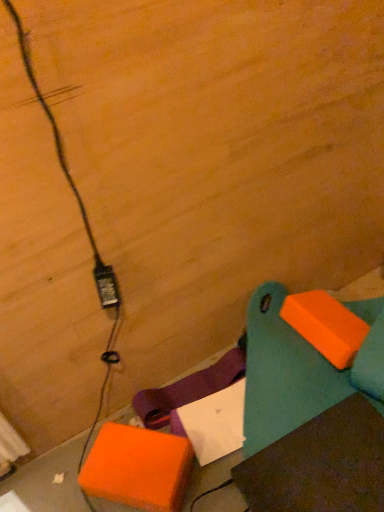
What do you see at coordinates (311, 416) in the screenshot? I see `teal plastic bench at lower right` at bounding box center [311, 416].

Where is `orange matte cardboard box at lower left`? orange matte cardboard box at lower left is located at coordinates (138, 468).

What's the angular difference between teal plastic bench at lower right and black plastic power plug at lower left's facing directions?

teal plastic bench at lower right and black plastic power plug at lower left are facing 73.4 degrees away from each other.

From a real-world perspective, is teal plastic bench at lower right physically above black plastic power plug at lower left?

No, from a real-world perspective, teal plastic bench at lower right is not above black plastic power plug at lower left.

Based on the photo, which of these two, teal plastic bench at lower right or black plastic power plug at lower left, stands shorter?

With less height is black plastic power plug at lower left.

Is teal plastic bench at lower right looking in the opposite direction of black plastic power plug at lower left?

No, black plastic power plug at lower left is not at the back of teal plastic bench at lower right.

Considering the positions of objects orange matte cardboard box at lower left and teal plastic bench at lower right in the image provided, who is behind, orange matte cardboard box at lower left or teal plastic bench at lower right?

orange matte cardboard box at lower left is behind.

Between orange matte cardboard box at lower left and teal plastic bench at lower right, which one has less height?

Standing shorter between the two is orange matte cardboard box at lower left.

Does orange matte cardboard box at lower left have a greater width compared to teal plastic bench at lower right?

No.

Is orange matte cardboard box at lower left facing towards teal plastic bench at lower right?

No, orange matte cardboard box at lower left is not oriented towards teal plastic bench at lower right.

Is orange matte cardboard box at lower left to the right of black plastic power plug at lower left from the viewer's perspective?

Yes, orange matte cardboard box at lower left is to the right of black plastic power plug at lower left.

Can you tell me how much orange matte cardboard box at lower left and black plastic power plug at lower left differ in facing direction?

22.3 degrees separate the facing orientations of orange matte cardboard box at lower left and black plastic power plug at lower left.

From their relative heights in the image, would you say orange matte cardboard box at lower left is taller or shorter than black plastic power plug at lower left?

In the image, orange matte cardboard box at lower left appears to be shorter than black plastic power plug at lower left.

Does orange matte cardboard box at lower left have a lesser width compared to black plastic power plug at lower left?

In fact, orange matte cardboard box at lower left might be wider than black plastic power plug at lower left.

Which object is positioned more to the left, teal plastic bench at lower right or orange matte cardboard box at lower left?

Positioned to the left is orange matte cardboard box at lower left.

From the image's perspective, is teal plastic bench at lower right beneath orange matte cardboard box at lower left?

No.

Does teal plastic bench at lower right turn towards orange matte cardboard box at lower left?

Yes.

Does black plastic power plug at lower left have a lesser width compared to orange matte cardboard box at lower left?

Yes.

How distant is black plastic power plug at lower left from orange matte cardboard box at lower left?

black plastic power plug at lower left and orange matte cardboard box at lower left are 14.51 inches apart from each other.

Looking at this image, considering the sizes of black plastic power plug at lower left and orange matte cardboard box at lower left in the image, is black plastic power plug at lower left taller or shorter than orange matte cardboard box at lower left?

black plastic power plug at lower left is taller than orange matte cardboard box at lower left.

Is black plastic power plug at lower left positioned beyond the bounds of orange matte cardboard box at lower left?

Indeed, black plastic power plug at lower left is completely outside orange matte cardboard box at lower left.

Does black plastic power plug at lower left touch teal plastic bench at lower right?

No, black plastic power plug at lower left is not next to teal plastic bench at lower right.

Does black plastic power plug at lower left appear on the left side of teal plastic bench at lower right?

Indeed, black plastic power plug at lower left is positioned on the left side of teal plastic bench at lower right.

From a real-world perspective, which object stands above the other?

Answer: black plastic power plug at lower left, from a real-world perspective.

In terms of width, does black plastic power plug at lower left look wider or thinner when compared to teal plastic bench at lower right?

Clearly, black plastic power plug at lower left has less width compared to teal plastic bench at lower right.

This screenshot has height=512, width=384. I want to click on furniture below the black plastic power plug at lower left (from a real-world perspective), so click(x=311, y=416).

Find the location of a particular element. This screenshot has height=512, width=384. furniture above the orange matte cardboard box at lower left (from the image's perspective) is located at coordinates (311, 416).

Considering their positions, is black plastic power plug at lower left positioned closer to orange matte cardboard box at lower left than teal plastic bench at lower right?

The object closer to orange matte cardboard box at lower left is teal plastic bench at lower right.

Consider the image. Estimate the real-world distances between objects in this image. Which object is closer to teal plastic bench at lower right, orange matte cardboard box at lower left or black plastic power plug at lower left?

Among the two, orange matte cardboard box at lower left is located nearer to teal plastic bench at lower right.

Looking at the image, which one is located further to black plastic power plug at lower left, orange matte cardboard box at lower left or teal plastic bench at lower right?

teal plastic bench at lower right lies further to black plastic power plug at lower left than the other object.

Which object lies further to the anchor point orange matte cardboard box at lower left, teal plastic bench at lower right or black plastic power plug at lower left?

black plastic power plug at lower left.

From the image, which object appears to be farther from black plastic power plug at lower left, teal plastic bench at lower right or orange matte cardboard box at lower left?

The object further to black plastic power plug at lower left is teal plastic bench at lower right.

Which object lies nearer to the anchor point teal plastic bench at lower right, black plastic power plug at lower left or orange matte cardboard box at lower left?

The object closer to teal plastic bench at lower right is orange matte cardboard box at lower left.

At what (x,y) coordinates should I click in order to perform the action: click on cardboard box between black plastic power plug at lower left and teal plastic bench at lower right in the horizontal direction. Please return your answer as a coordinate pair (x, y). The width and height of the screenshot is (384, 512). Looking at the image, I should click on (138, 468).